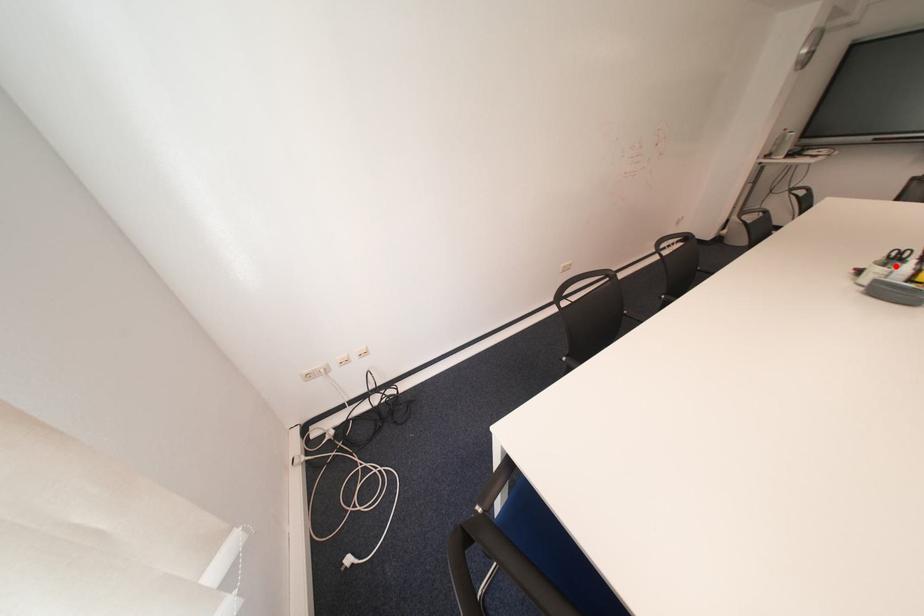
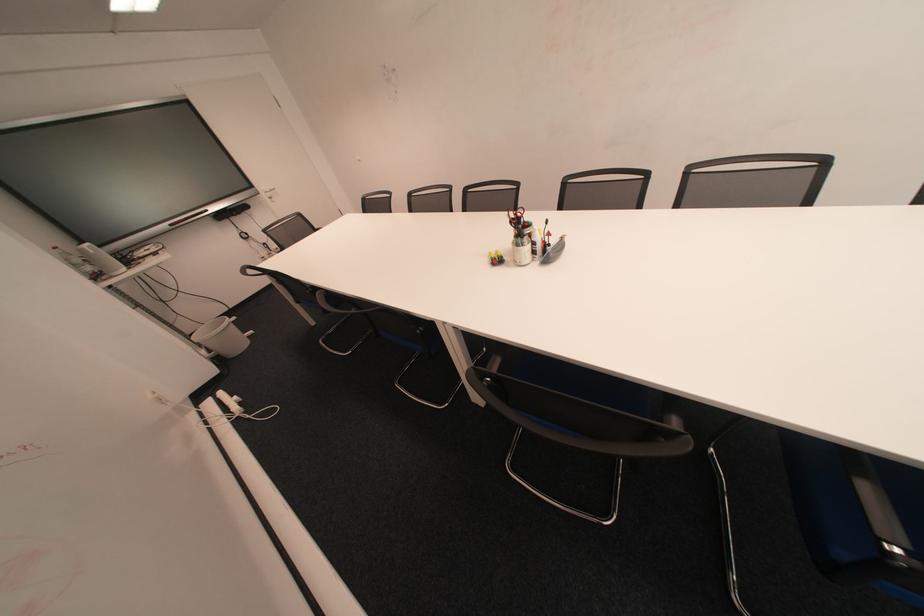
The point at the highlighted location is marked in the first image. Where is the corresponding point in the second image?

(529, 245)